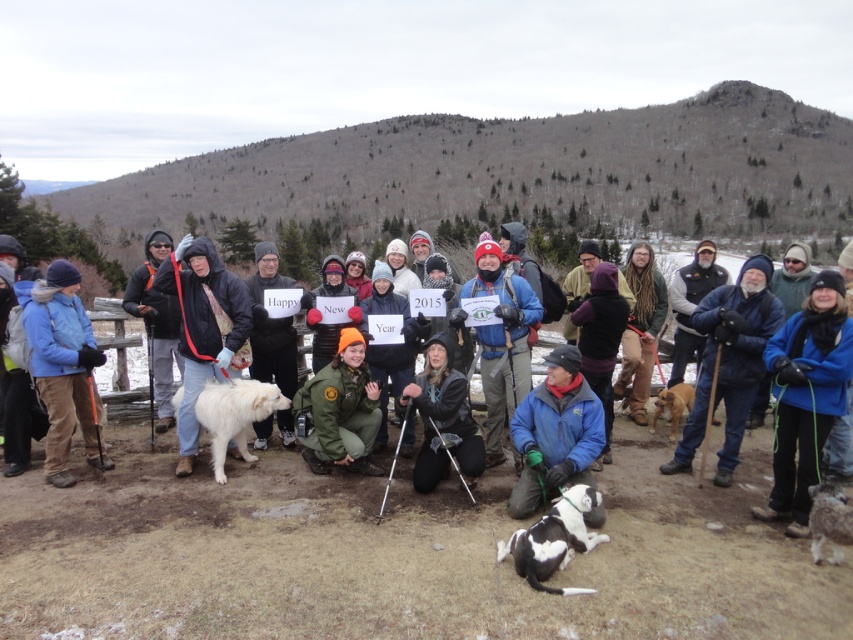
Question: From the image, what is the correct spatial relationship of blue fleece jacket at left in relation to golden brown fur at lower right?

Choices:
 (A) below
 (B) above

Answer: (B)

Question: Can you confirm if black leather jacket at center is positioned below white fluffy dog at center?

Choices:
 (A) yes
 (B) no

Answer: (B)

Question: Which of these objects is positioned farthest from the blue fleece jacket at lower right?

Choices:
 (A) fluffy white dog at lower right
 (B) golden brown fur at lower right

Answer: (B)

Question: Which is farther from the black leather jacket at center?

Choices:
 (A) green uniform at center
 (B) blue fleece jacket at center

Answer: (B)

Question: Considering the real-world distances, which object is closest to the fluffy white dog at lower right?

Choices:
 (A) blue fleece jacket at lower right
 (B) golden brown fur at lower right

Answer: (A)

Question: Can you confirm if white fluffy dog at center is thinner than golden brown fur at lower right?

Choices:
 (A) no
 (B) yes

Answer: (A)